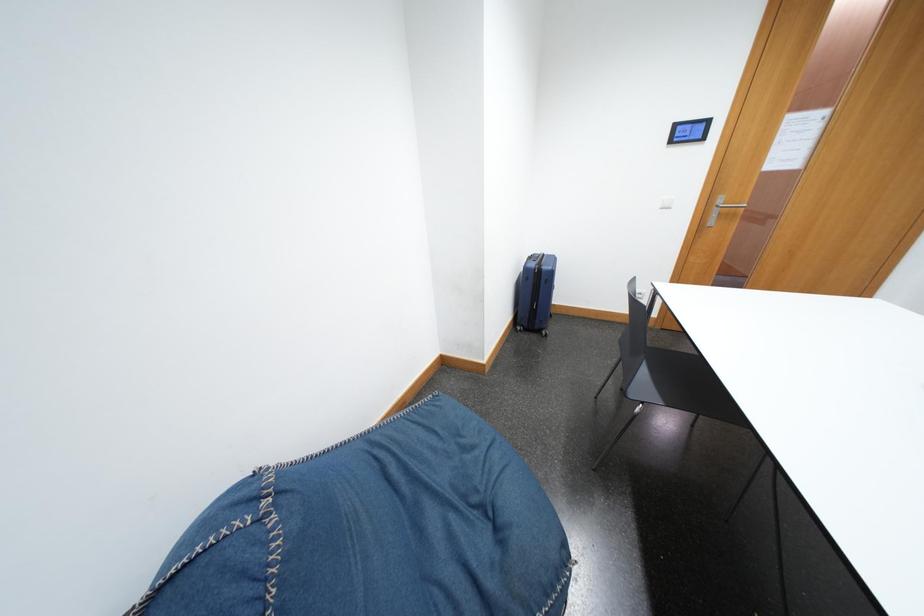
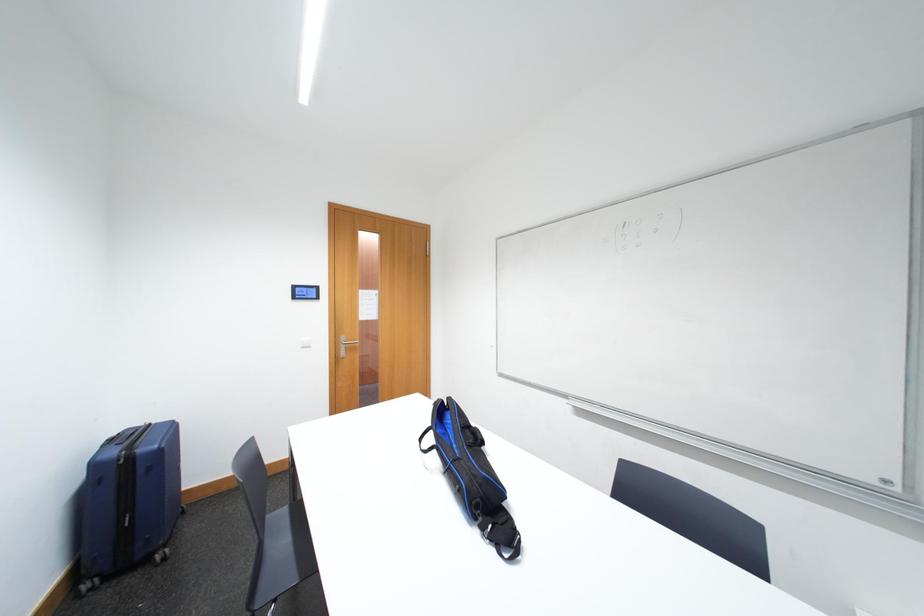
Question: The first image is from the beginning of the video and the second image is from the end. How did the camera likely rotate when shooting the video?

Choices:
 (A) Left
 (B) Right
 (C) Up
 (D) Down

Answer: (B)